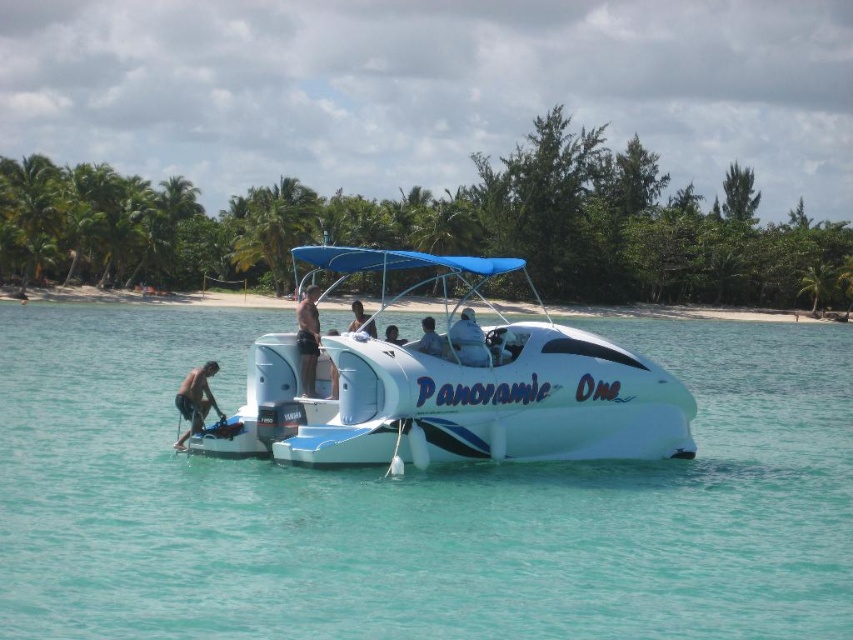
You are a photographer planning to take a photo of the skinny man at lower left and the dark brown shorts at center. Based on their sizes, which object should you focus on first to ensure proper framing?

The skinny man at lower left is larger in size compared to the dark brown shorts at center, so you should focus on the skinny man at lower left first to ensure proper framing.